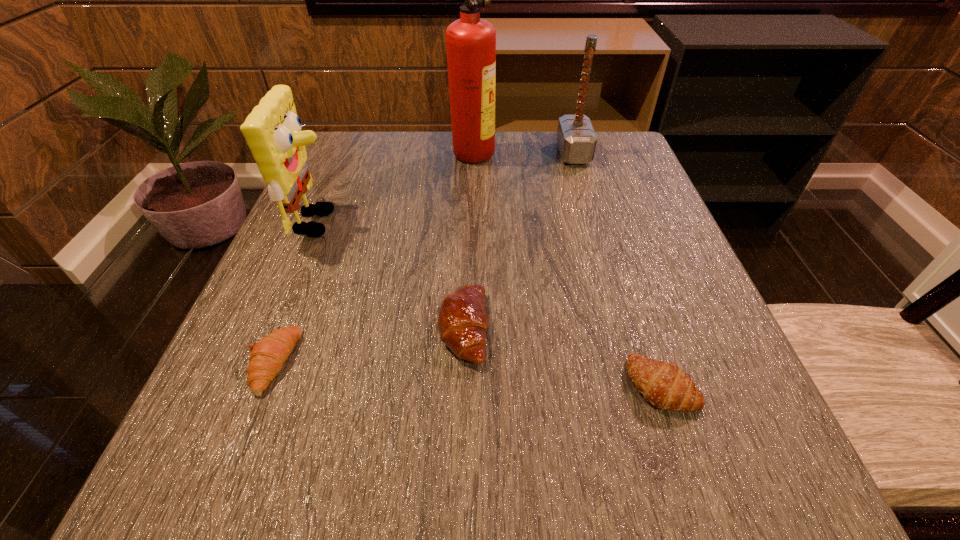
Identify the location of crescent roll situated at the right edge. Image resolution: width=960 pixels, height=540 pixels. (664, 385).

Identify the location of object that is positioned at the far right corner. The image size is (960, 540). (576, 138).

Where is `blank space at the far edge of the desktop`? The height and width of the screenshot is (540, 960). blank space at the far edge of the desktop is located at coordinates (434, 150).

At what (x,y) coordinates should I click in order to perform the action: click on vacant space at the near edge. Please return your answer as a coordinate pair (x, y). This screenshot has height=540, width=960. Looking at the image, I should click on point(636,468).

This screenshot has width=960, height=540. I want to click on vacant space at the left edge of the desktop, so pyautogui.click(x=350, y=196).

Locate an element on the screen. This screenshot has width=960, height=540. free space at the right edge is located at coordinates (712, 346).

This screenshot has height=540, width=960. In order to click on vacant space at the far left corner of the desktop in this screenshot , I will do tap(344, 148).

In the image, there is a desktop. At what (x,y) coordinates should I click in order to perform the action: click on free space at the near left corner. Please return your answer as a coordinate pair (x, y). Looking at the image, I should click on tap(219, 471).

Where is `vacant position at the far right corner of the desktop`? The height and width of the screenshot is (540, 960). vacant position at the far right corner of the desktop is located at coordinates (630, 180).

At what (x,y) coordinates should I click in order to perform the action: click on free space between the shortest crescent roll and the hammer. Please return your answer as a coordinate pair (x, y). Looking at the image, I should click on (423, 258).